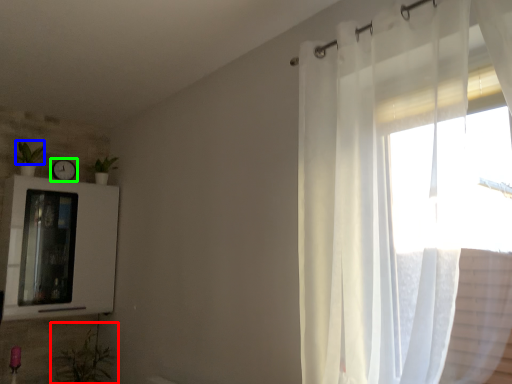
Question: Which object is the closest to the plant (highlighted by a red box)? Choose among these: plant (highlighted by a blue box) or clock (highlighted by a green box).

Choices:
 (A) plant
 (B) clock

Answer: (B)